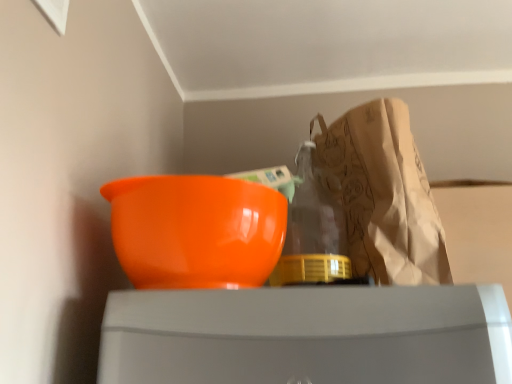
Find the location of `glossy plastic bowl at left`. glossy plastic bowl at left is located at coordinates (196, 230).

The width and height of the screenshot is (512, 384). Describe the element at coordinates (196, 230) in the screenshot. I see `glossy plastic bowl at left` at that location.

Locate an element on the screen. The width and height of the screenshot is (512, 384). brown paper grocery bag at upper right is located at coordinates (384, 195).

This screenshot has height=384, width=512. Describe the element at coordinates (384, 195) in the screenshot. I see `brown paper grocery bag at upper right` at that location.

The width and height of the screenshot is (512, 384). What are the coordinates of `glossy plastic bowl at left` in the screenshot? It's located at (196, 230).

Considering the positions of objects glossy plastic bowl at left and brown paper grocery bag at upper right in the image provided, who is more to the right, glossy plastic bowl at left or brown paper grocery bag at upper right?

brown paper grocery bag at upper right is more to the right.

Is glossy plastic bowl at left positioned before brown paper grocery bag at upper right?

Yes, glossy plastic bowl at left is closer to the camera.

Does point (275, 215) lie in front of point (352, 191)?

That is True.

From the image's perspective, between glossy plastic bowl at left and brown paper grocery bag at upper right, who is located below?

glossy plastic bowl at left appears lower in the image.

From a real-world perspective, which object rests below the other?

From a 3D spatial view, glossy plastic bowl at left is below.

Considering the sizes of objects glossy plastic bowl at left and brown paper grocery bag at upper right in the image provided, who is wider, glossy plastic bowl at left or brown paper grocery bag at upper right?

With larger width is brown paper grocery bag at upper right.

Considering the sizes of objects glossy plastic bowl at left and brown paper grocery bag at upper right in the image provided, who is shorter, glossy plastic bowl at left or brown paper grocery bag at upper right?

Standing shorter between the two is glossy plastic bowl at left.

Which of these two, glossy plastic bowl at left or brown paper grocery bag at upper right, is smaller?

Smaller between the two is glossy plastic bowl at left.

Is brown paper grocery bag at upper right completely or partially inside glossy plastic bowl at left?

No, brown paper grocery bag at upper right is not a part of glossy plastic bowl at left.

Does glossy plastic bowl at left touch brown paper grocery bag at upper right?

They are not placed beside each other.

Is glossy plastic bowl at left aimed at brown paper grocery bag at upper right?

No, glossy plastic bowl at left is not facing towards brown paper grocery bag at upper right.

How different are the orientations of glossy plastic bowl at left and brown paper grocery bag at upper right in degrees?

glossy plastic bowl at left and brown paper grocery bag at upper right are facing 0.00317 degrees away from each other.

In order to click on grocery bag lying above the glossy plastic bowl at left (from the image's perspective) in this screenshot , I will do `click(384, 195)`.

Can you confirm if brown paper grocery bag at upper right is positioned to the right of glossy plastic bowl at left?

Yes.

Considering the relative positions of brown paper grocery bag at upper right and glossy plastic bowl at left in the image provided, is brown paper grocery bag at upper right behind glossy plastic bowl at left?

Yes, it is.

Which is behind, point (423, 276) or point (213, 216)?

The point (423, 276) is farther.

From the image's perspective, would you say brown paper grocery bag at upper right is positioned over glossy plastic bowl at left?

Indeed, from the image's perspective, brown paper grocery bag at upper right is shown above glossy plastic bowl at left.

From a real-world perspective, which object rests below the other?

From a 3D spatial view, glossy plastic bowl at left is below.

Which object is wider, brown paper grocery bag at upper right or glossy plastic bowl at left?

brown paper grocery bag at upper right is wider.

Is brown paper grocery bag at upper right taller or shorter than glossy plastic bowl at left?

Considering their sizes, brown paper grocery bag at upper right has more height than glossy plastic bowl at left.

Looking at the image, does brown paper grocery bag at upper right seem bigger or smaller compared to glossy plastic bowl at left?

In the image, brown paper grocery bag at upper right appears to be larger than glossy plastic bowl at left.

Can we say brown paper grocery bag at upper right lies outside glossy plastic bowl at left?

Yes, brown paper grocery bag at upper right is not within glossy plastic bowl at left.

Does brown paper grocery bag at upper right touch glossy plastic bowl at left?

No, brown paper grocery bag at upper right is not with glossy plastic bowl at left.

Consider the image. Is brown paper grocery bag at upper right positioned with its back to glossy plastic bowl at left?

brown paper grocery bag at upper right is not turned away from glossy plastic bowl at left.

At what (x,y) coordinates should I click in order to perform the action: click on bowl in front of the brown paper grocery bag at upper right. Please return your answer as a coordinate pair (x, y). Image resolution: width=512 pixels, height=384 pixels. Looking at the image, I should click on (196, 230).

Where is `grocery bag on the right of glossy plastic bowl at left`? grocery bag on the right of glossy plastic bowl at left is located at coordinates (384, 195).

What are the coordinates of `bowl in front of the brown paper grocery bag at upper right` in the screenshot? It's located at (196, 230).